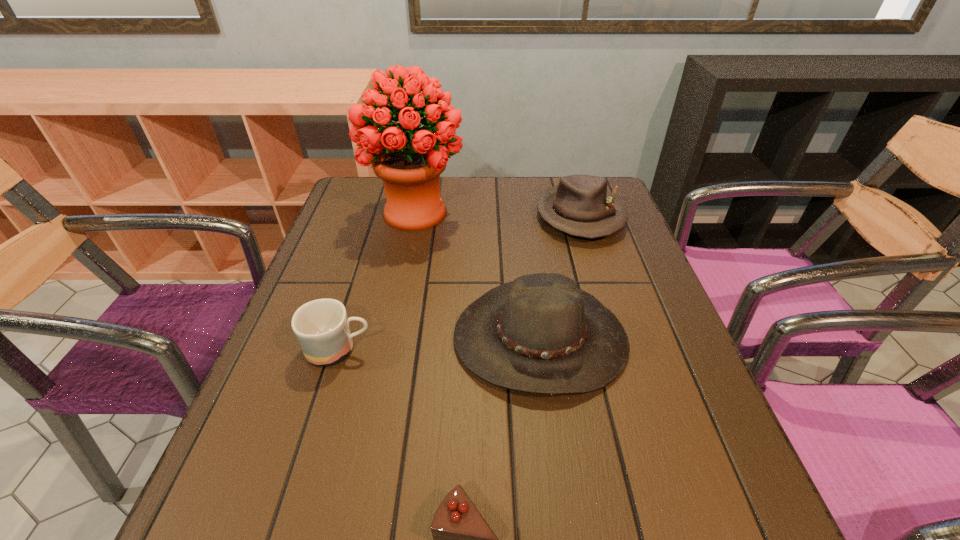
This screenshot has width=960, height=540. I want to click on hat located in the far edge section of the desktop, so click(580, 205).

At what (x,y) coordinates should I click in order to perform the action: click on bouquet at the left edge. Please return your answer as a coordinate pair (x, y). The height and width of the screenshot is (540, 960). Looking at the image, I should click on (409, 159).

You are a GUI agent. You are given a task and a screenshot of the screen. Output one action in this format:
    pyautogui.click(x=<x>, y=<y>)
    Task: Click on the mug present at the left edge
    
    Given the screenshot: What is the action you would take?
    pyautogui.click(x=321, y=326)

Locate an element on the screen. The width and height of the screenshot is (960, 540). object present at the far left corner is located at coordinates (409, 159).

Identify the location of object situated at the far right corner. (580, 205).

Identify the location of vacant space at the far edge. (488, 204).

In the image, there is a desktop. Where is `free space at the near edge`? This screenshot has width=960, height=540. free space at the near edge is located at coordinates (580, 499).

What are the coordinates of `free space at the left edge of the desktop` in the screenshot? It's located at (257, 424).

At what (x,y) coordinates should I click in order to perform the action: click on vacant space at the right edge of the desktop. Please return your answer as a coordinate pair (x, y). Looking at the image, I should click on (644, 314).

This screenshot has width=960, height=540. In the image, there is a desktop. Find the location of `free space at the far left corner`. free space at the far left corner is located at coordinates (358, 188).